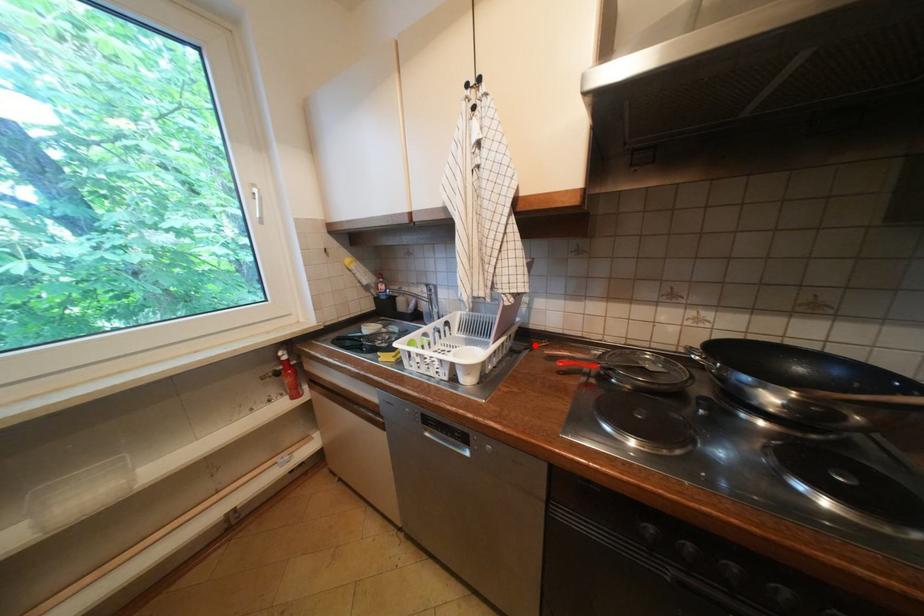
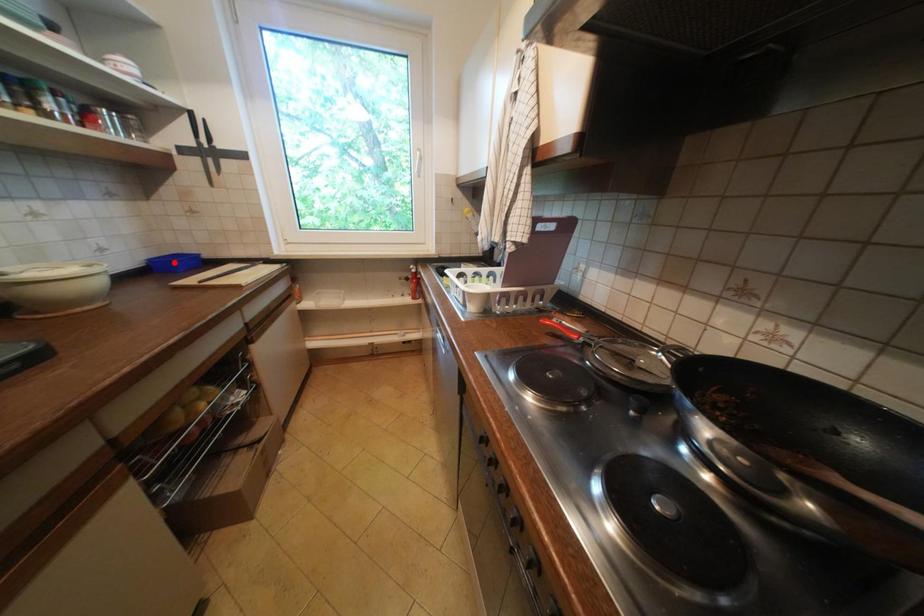
I am providing you with two images of the same scene from different viewpoints. A red point is marked on the first image and another point is marked on the second image. Is the marked point in image1 the same physical position as the marked point in image2?

No